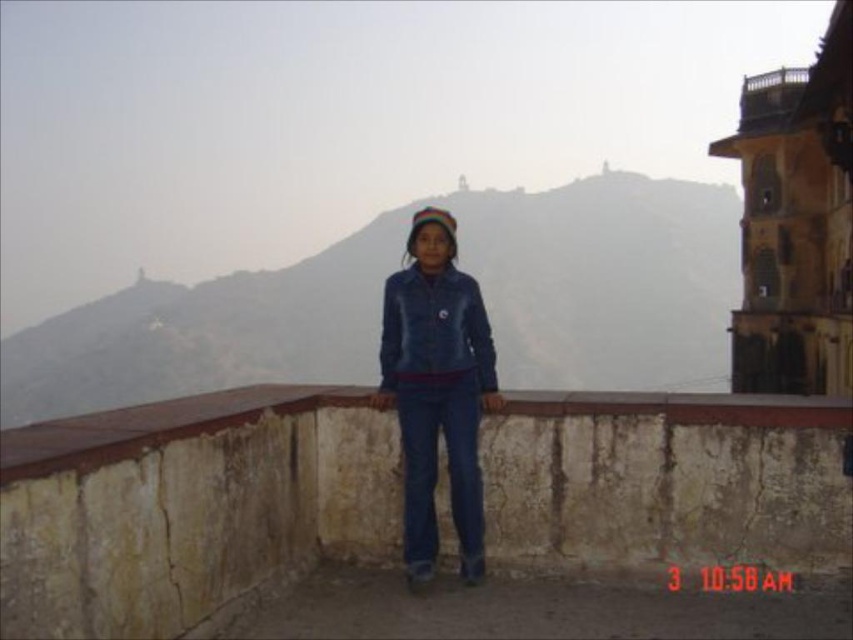
Does foggy stone mountain at upper center have a greater width compared to wooden railing at upper right?

Correct, the width of foggy stone mountain at upper center exceeds that of wooden railing at upper right.

Does foggy stone mountain at upper center have a smaller size compared to wooden railing at upper right?

No.

The width and height of the screenshot is (853, 640). What do you see at coordinates (605, 280) in the screenshot?
I see `foggy stone mountain at upper center` at bounding box center [605, 280].

Identify the location of foggy stone mountain at upper center. (605, 280).

Which is above, matte blue jacket at center or wooden railing at upper right?

wooden railing at upper right

Can you confirm if matte blue jacket at center is positioned to the right of wooden railing at upper right?

Incorrect, matte blue jacket at center is not on the right side of wooden railing at upper right.

The height and width of the screenshot is (640, 853). Find the location of `matte blue jacket at center`. matte blue jacket at center is located at coordinates (434, 330).

Does point (553, 256) come in front of point (479, 291)?

No, it is behind (479, 291).

Does foggy stone mountain at upper center come in front of denim jacket at center?

That is False.

Where is `foggy stone mountain at upper center`? This screenshot has width=853, height=640. foggy stone mountain at upper center is located at coordinates (605, 280).